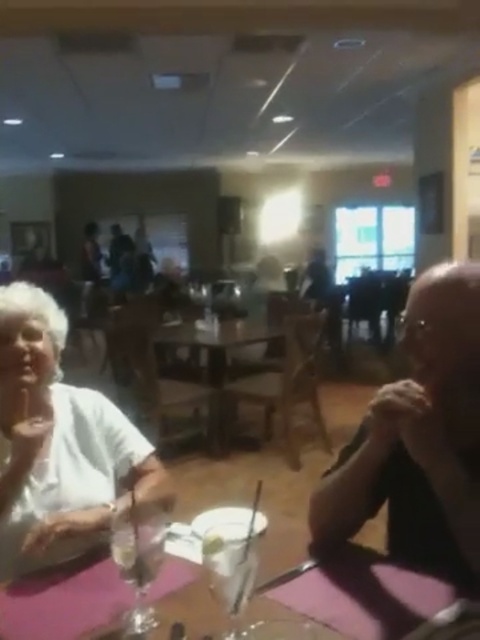
Which is in front, point (359, 428) or point (362, 552)?

Positioned in front is point (362, 552).

Is point (408, 515) positioned behind point (288, 592)?

Yes, it is.

The height and width of the screenshot is (640, 480). In order to click on smooth black shirt at right in this screenshot , I will do `click(419, 440)`.

Does smooth black shirt at right have a greater height compared to white matte shirt at left?

No, smooth black shirt at right is not taller than white matte shirt at left.

Does smooth black shirt at right have a greater width compared to white matte shirt at left?

In fact, smooth black shirt at right might be narrower than white matte shirt at left.

Is point (444, 307) farther from viewer compared to point (108, 460)?

That is False.

At what (x,y) coordinates should I click in order to perform the action: click on smooth black shirt at right. Please return your answer as a coordinate pair (x, y). This screenshot has height=640, width=480. Looking at the image, I should click on (419, 440).

Which is in front, point (26, 529) or point (303, 586)?

Positioned in front is point (303, 586).

Locate an element on the screen. The height and width of the screenshot is (640, 480). white matte shirt at left is located at coordinates (59, 444).